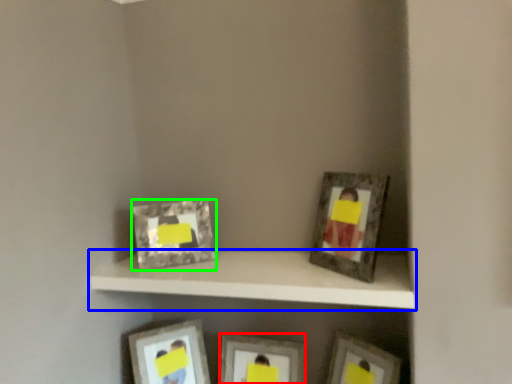
Question: Which object is positioned farthest from picture frame (highlighted by a red box)? Select from shelf (highlighted by a blue box) and picture frame (highlighted by a green box).

Choices:
 (A) shelf
 (B) picture frame

Answer: (B)